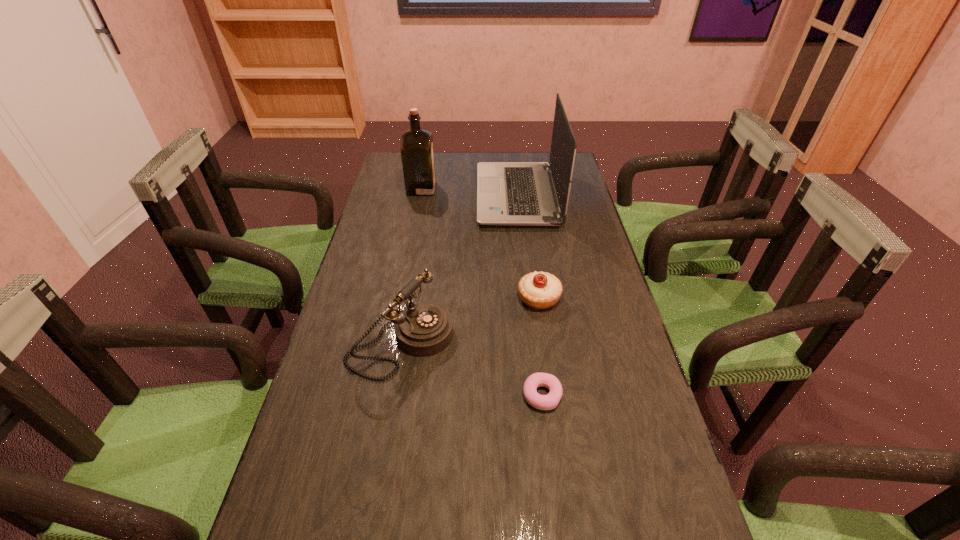
Identify the location of object that is positioned at the far left corner. This screenshot has height=540, width=960. (417, 153).

This screenshot has width=960, height=540. I want to click on object that is at the far right corner, so click(508, 193).

You are a GUI agent. You are given a task and a screenshot of the screen. Output one action in this format:
    pyautogui.click(x=<x>, y=<y>)
    Task: Click on the vacant space at the far edge of the desktop
    The image size is (960, 540).
    Given the screenshot: What is the action you would take?
    click(526, 160)

Where is `vacant space at the left edge`? The width and height of the screenshot is (960, 540). vacant space at the left edge is located at coordinates (313, 468).

Locate an element on the screen. The width and height of the screenshot is (960, 540). free region at the right edge of the desktop is located at coordinates coord(564,229).

Image resolution: width=960 pixels, height=540 pixels. I want to click on free space at the far left corner of the desktop, so click(399, 167).

This screenshot has width=960, height=540. Identify the location of empty location between the nearer pastry and the second shortest object. tap(540, 346).

You are a GUI agent. You are given a task and a screenshot of the screen. Output one action in this format:
    pyautogui.click(x=<x>, y=<y>)
    Task: Click on the free space between the third shortest object and the laptop computer
    
    Given the screenshot: What is the action you would take?
    pyautogui.click(x=459, y=268)

Locate an element on the screen. free space between the telephone and the laptop computer is located at coordinates (459, 268).

You are a GUI agent. You are given a task and a screenshot of the screen. Output one action in this format:
    pyautogui.click(x=<x>, y=<y>)
    Task: Click on the vacant space that's between the liquor and the telephone
    The height and width of the screenshot is (540, 960).
    Given the screenshot: What is the action you would take?
    pyautogui.click(x=411, y=265)